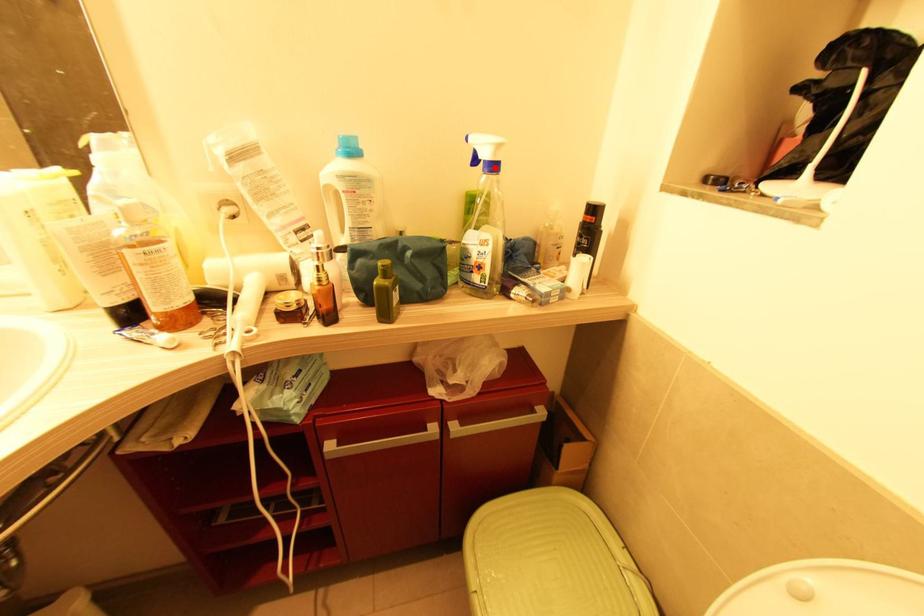
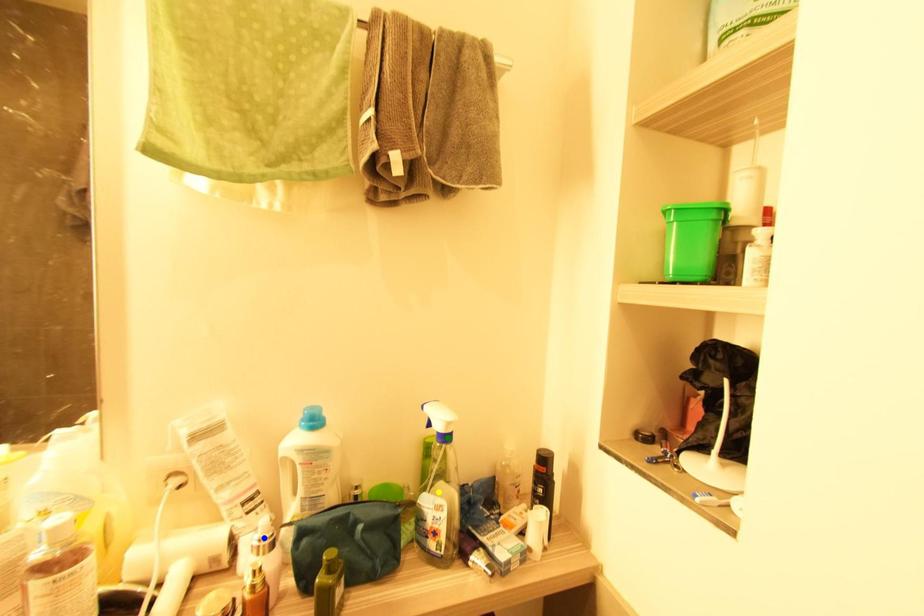
Question: I am providing you with two images of the same scene from different viewpoints. A red point is marked on the first image. You are given multiple points on the second image. In image 2, which mark is for the same physical point as the one in image 1?

Choices:
 (A) yellow point
 (B) green point
 (C) blue point

Answer: (B)